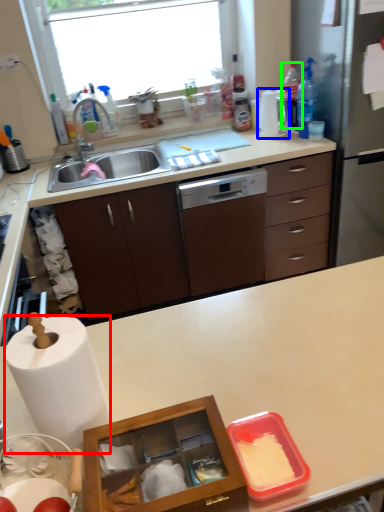
Question: Which object is the closest to the paper towel (highlighted by a red box)? Choose among these: kitchen appliance (highlighted by a blue box) or bottle (highlighted by a green box).

Choices:
 (A) kitchen appliance
 (B) bottle

Answer: (A)